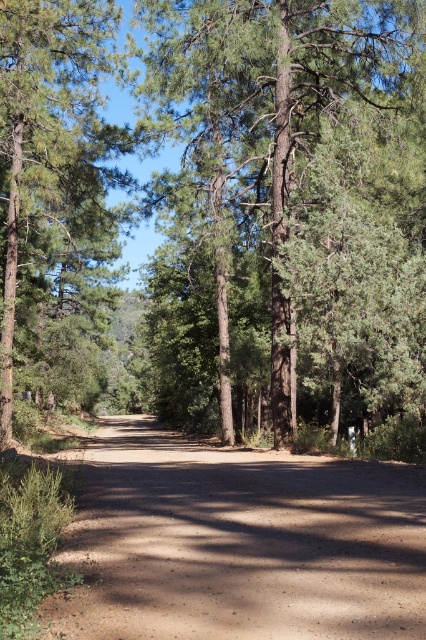
You are planning to walk along the dirt path in the forest. You notice the brown gravel road at center and the green matte tree at left. Which one is larger in size?

The green matte tree at left is larger in size than the brown gravel road at center.

You are a hiker standing at the start of the forest path. You need to reach a cabin located beyond the green matte tree at left. Which direction should you head relative to the brown gravel road at center?

The brown gravel road at center is positioned on the right side of the green matte tree at left. To reach the cabin beyond the green matte tree at left, you should head to the left of the brown gravel road at center.